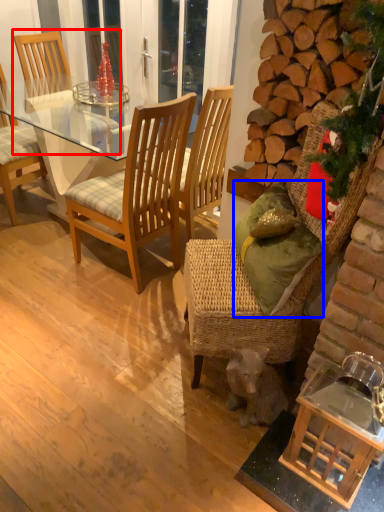
Question: Which object appears farthest to the camera in this image, chair (highlighted by a red box) or pillow (highlighted by a blue box)?

Choices:
 (A) chair
 (B) pillow

Answer: (A)